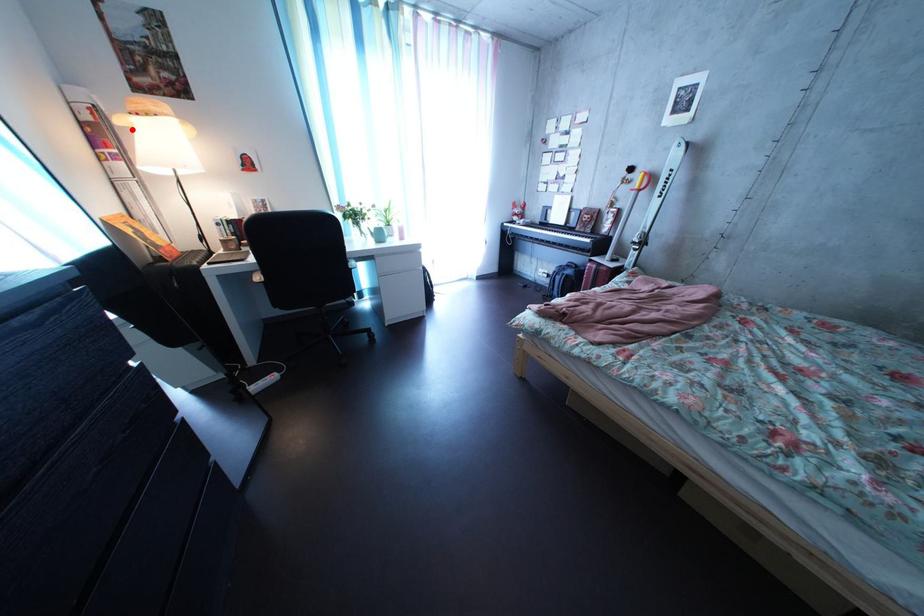
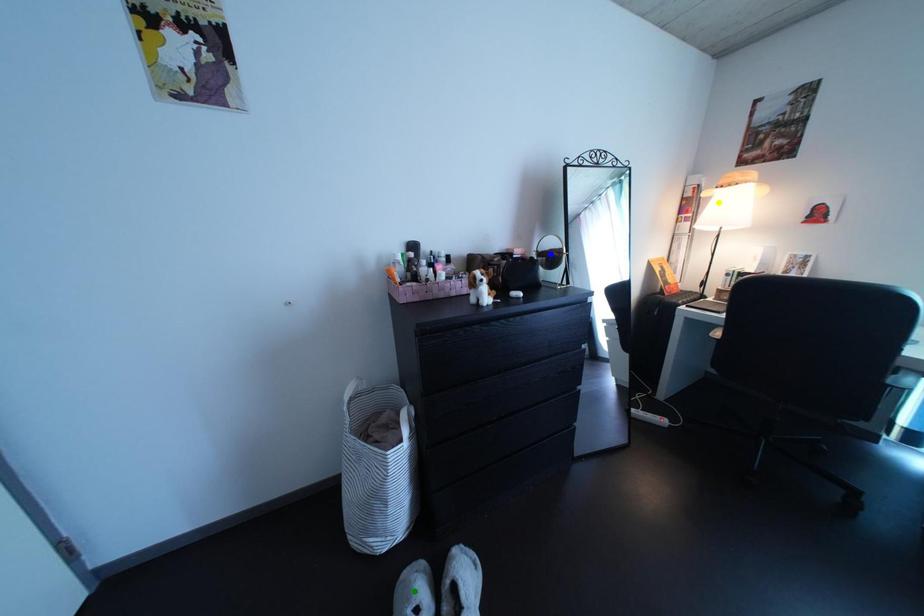
Question: I am providing you with two images of the same scene from different viewpoints. A red point is marked on the first image. You are given multiple points on the second image. In image 2, which mark is for the same physical point as the one in image 1?

Choices:
 (A) blue point
 (B) green point
 (C) yellow point

Answer: (C)